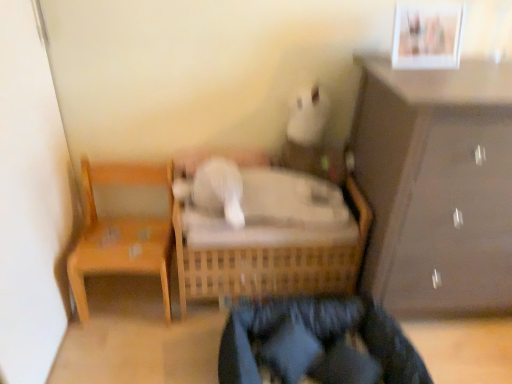
Question: Considering the relative sizes of white glossy picture frame at upper right and matte brown cabinet at right in the image provided, is white glossy picture frame at upper right bigger than matte brown cabinet at right?

Choices:
 (A) no
 (B) yes

Answer: (A)

Question: Is white glossy picture frame at upper right behind matte brown cabinet at right?

Choices:
 (A) no
 (B) yes

Answer: (B)

Question: Would you say white glossy picture frame at upper right is a long distance from matte brown cabinet at right?

Choices:
 (A) no
 (B) yes

Answer: (A)

Question: From a real-world perspective, is white glossy picture frame at upper right physically above matte brown cabinet at right?

Choices:
 (A) yes
 (B) no

Answer: (A)

Question: Is white glossy picture frame at upper right not inside matte brown cabinet at right?

Choices:
 (A) yes
 (B) no

Answer: (A)

Question: Choose the correct answer: Is wooden chair at left inside matte brown cabinet at right or outside it?

Choices:
 (A) outside
 (B) inside

Answer: (A)

Question: Considering the positions of wooden chair at left and matte brown cabinet at right in the image, is wooden chair at left taller or shorter than matte brown cabinet at right?

Choices:
 (A) tall
 (B) short

Answer: (B)

Question: In the image, is wooden chair at left positioned in front of or behind matte brown cabinet at right?

Choices:
 (A) front
 (B) behind

Answer: (B)

Question: From the image's perspective, relative to matte brown cabinet at right, is wooden chair at left above or below?

Choices:
 (A) below
 (B) above

Answer: (A)

Question: Considering their positions, is matte brown cabinet at right located in front of or behind white glossy picture frame at upper right?

Choices:
 (A) front
 (B) behind

Answer: (A)

Question: In terms of size, does matte brown cabinet at right appear bigger or smaller than white glossy picture frame at upper right?

Choices:
 (A) small
 (B) big

Answer: (B)

Question: Do you think matte brown cabinet at right is within white glossy picture frame at upper right, or outside of it?

Choices:
 (A) outside
 (B) inside

Answer: (A)

Question: Considering the positions of matte brown cabinet at right and white glossy picture frame at upper right in the image, is matte brown cabinet at right wider or thinner than white glossy picture frame at upper right?

Choices:
 (A) wide
 (B) thin

Answer: (A)

Question: In the image, is matte brown cabinet at right positioned in front of or behind wooden chair at left?

Choices:
 (A) front
 (B) behind

Answer: (A)

Question: In terms of width, does matte brown cabinet at right look wider or thinner when compared to wooden chair at left?

Choices:
 (A) wide
 (B) thin

Answer: (A)